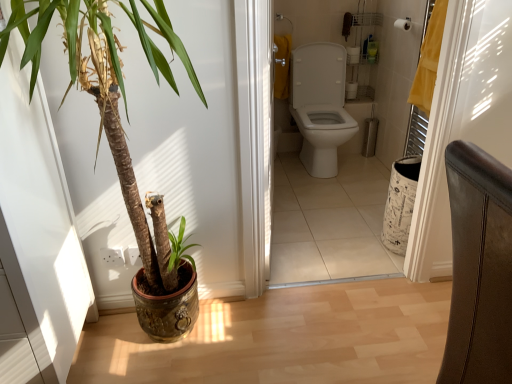
Question: Does point (168, 71) appear closer or farther from the camera than point (467, 158)?

Choices:
 (A) closer
 (B) farther

Answer: (B)

Question: From a real-world perspective, is green glossy plant at left positioned above or below leather-like chair at right?

Choices:
 (A) below
 (B) above

Answer: (B)

Question: Estimate the real-world distances between objects in this image. Which object is farther from the leather-like chair at right?

Choices:
 (A) white glossy toilet at center
 (B) white matte toilet paper at upper center
 (C) green glossy plant at left

Answer: (B)

Question: Estimate the real-world distances between objects in this image. Which object is farther from the green glossy plant at left?

Choices:
 (A) white glossy toilet at center
 (B) white matte toilet paper at upper center
 (C) leather-like chair at right

Answer: (B)